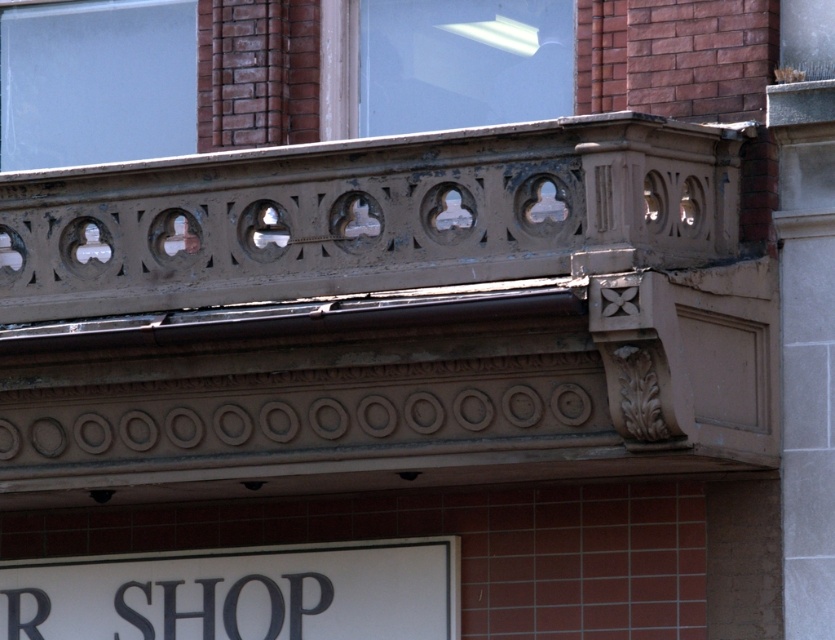
Does transparent glass window at upper left appear under transparent glass window at upper center?

Yes, transparent glass window at upper left is below transparent glass window at upper center.

Who is higher up, transparent glass window at upper left or transparent glass window at upper center?

transparent glass window at upper center is higher up.

Is point (64, 67) farther from camera compared to point (358, 36)?

That is True.

Locate an element on the screen. Image resolution: width=835 pixels, height=640 pixels. transparent glass window at upper left is located at coordinates (95, 81).

Is matte brown balcony at upper center positioned before transparent glass window at upper left?

Yes, it is in front of transparent glass window at upper left.

Is matte brown balcony at upper center smaller than transparent glass window at upper left?

Incorrect, matte brown balcony at upper center is not smaller in size than transparent glass window at upper left.

Does point (33, 176) lie behind point (6, 58)?

No, it is not.

Locate an element on the screen. The height and width of the screenshot is (640, 835). matte brown balcony at upper center is located at coordinates (385, 314).

Does matte brown balcony at upper center have a larger size compared to white matte sign at lower center?

Indeed, matte brown balcony at upper center has a larger size compared to white matte sign at lower center.

What do you see at coordinates (385, 314) in the screenshot? I see `matte brown balcony at upper center` at bounding box center [385, 314].

This screenshot has width=835, height=640. I want to click on matte brown balcony at upper center, so [x=385, y=314].

What are the coordinates of `matte brown balcony at upper center` in the screenshot? It's located at (385, 314).